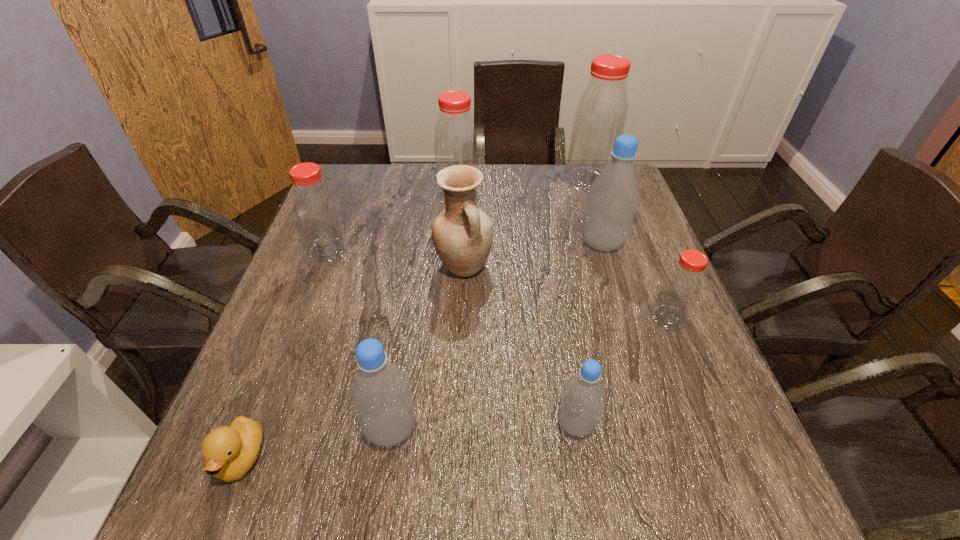
This screenshot has width=960, height=540. Identify the location of the biggest red bottle. (601, 114).

Locate an element on the screen. This screenshot has width=960, height=540. the tallest bottle is located at coordinates (601, 114).

This screenshot has width=960, height=540. What are the coordinates of `the third red bottle from right to left` in the screenshot? It's located at (455, 137).

Locate an element on the screen. the biggest gray bottle is located at coordinates (613, 197).

In order to click on the rightmost gray bottle in this screenshot , I will do `click(613, 197)`.

Where is `pottery`? pottery is located at coordinates click(462, 234).

The image size is (960, 540). What are the coordinates of `the second nearest red bottle` in the screenshot? It's located at (316, 211).

In order to click on the leftmost red bottle in this screenshot , I will do tap(316, 211).

At what (x,y) coordinates should I click in order to perform the action: click on the leftmost gray bottle. Please return your answer as a coordinate pair (x, y). Image resolution: width=960 pixels, height=540 pixels. Looking at the image, I should click on (381, 397).

Locate an element on the screen. This screenshot has height=540, width=960. the nearest red bottle is located at coordinates (681, 288).